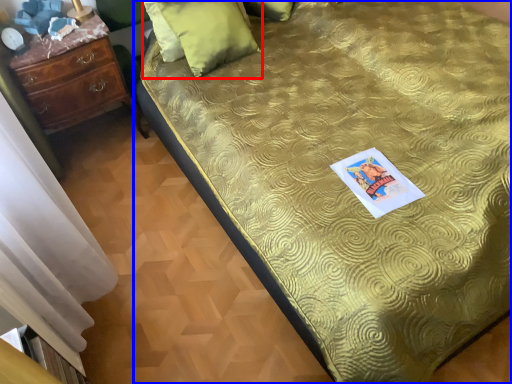
Question: Which of the following is the closest to the observer, pillow (highlighted by a red box) or bed (highlighted by a blue box)?

Choices:
 (A) pillow
 (B) bed

Answer: (B)